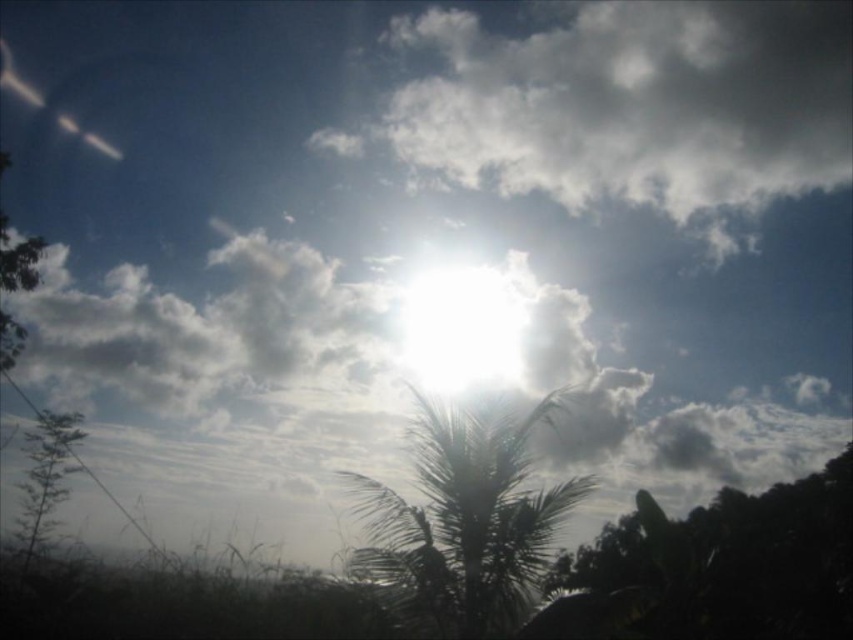
Consider the image. How far apart are green leafy tree at lower right and silhouette leafy palm at center?

The distance of green leafy tree at lower right from silhouette leafy palm at center is 3.77 meters.

Between green leafy tree at lower right and silhouette leafy palm at center, which one has less height?

Standing shorter between the two is green leafy tree at lower right.

Identify the location of green leafy tree at lower right. (730, 563).

At what (x,y) coordinates should I click in order to perform the action: click on green leafy tree at lower right. Please return your answer as a coordinate pair (x, y). The height and width of the screenshot is (640, 853). Looking at the image, I should click on 730,563.

Is green leafy tree at lower right positioned at the back of bright white sun at center?

No, it is in front of bright white sun at center.

Which is more to the left, green leafy tree at lower right or bright white sun at center?

bright white sun at center

Does point (833, 468) lie behind point (512, 378)?

Yes, it is.

The image size is (853, 640). Identify the location of green leafy tree at lower right. (730, 563).

Looking at this image, between bright white sun at center and green leafy plant at lower left, which one appears on the left side from the viewer's perspective?

From the viewer's perspective, green leafy plant at lower left appears more on the left side.

Consider the image. Who is positioned more to the right, bright white sun at center or green leafy plant at lower left?

bright white sun at center is more to the right.

Is point (471, 358) more distant than point (39, 456)?

Yes.

Where is `bright white sun at center`? bright white sun at center is located at coordinates (462, 328).